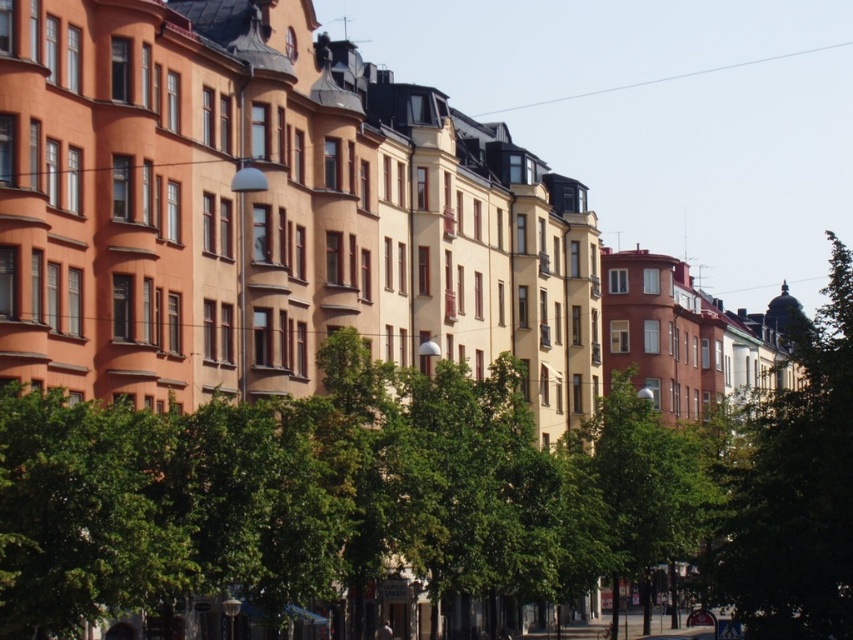
Question: Can you confirm if green leafy tree at right is smaller than transparent wire at upper center?

Choices:
 (A) yes
 (B) no

Answer: (B)

Question: Among these points, which one is nearest to the camera?

Choices:
 (A) (38, 568)
 (B) (782, 58)
 (C) (762, 563)

Answer: (A)

Question: Which of the following is the closest to the observer?

Choices:
 (A) green leafy tree at right
 (B) green leafy tree at center

Answer: (B)

Question: Is green leafy tree at center wider than green leafy tree at right?

Choices:
 (A) no
 (B) yes

Answer: (A)

Question: Is green leafy tree at right thinner than transparent wire at upper center?

Choices:
 (A) yes
 (B) no

Answer: (A)

Question: Which point is closer to the camera?

Choices:
 (A) transparent wire at upper center
 (B) green leafy tree at right

Answer: (B)